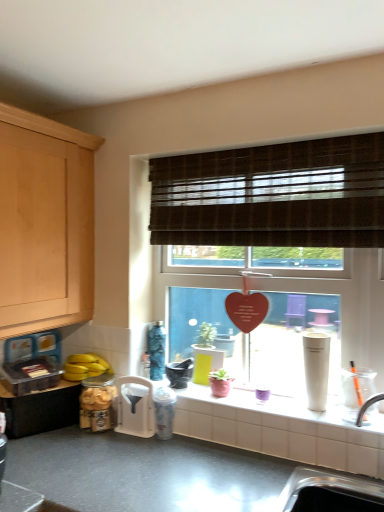
Describe the element at coordinates (329, 492) in the screenshot. Image resolution: width=384 pixels, height=512 pixels. I see `silver metallic sink at lower right` at that location.

Measure the distance between point (117, 418) and camera.

The depth of point (117, 418) is 5.91 feet.

What do you see at coordinates (246, 310) in the screenshot? I see `wooden heart at center` at bounding box center [246, 310].

This screenshot has height=512, width=384. I want to click on wooden heart at center, so click(246, 310).

The height and width of the screenshot is (512, 384). What do you see at coordinates (179, 373) in the screenshot?
I see `matte black mortar at center, which is the third appliance in left-to-right order` at bounding box center [179, 373].

The image size is (384, 512). Identify the location of metallic gray countertop at lower center. (144, 473).

This screenshot has width=384, height=512. I want to click on black matte cabinet at lower left, so click(40, 410).

Identify the location of silver metallic sink at lower right. (329, 492).

Based on the photo, from the image's perspective, is white plastic funnel at lower center, positioned as the second appliance in left-to-right order, beneath brown woven blind at upper center?

Yes.

Is white plastic funnel at lower center, positioned as the second appliance in left-to-right order, behind brown woven blind at upper center?

Yes, white plastic funnel at lower center, positioned as the second appliance in left-to-right order, is further from the viewer.

Which point is more forward, (133, 426) or (280, 169)?

Positioned in front is point (280, 169).

From a real-world perspective, is white plastic funnel at lower center, positioned as the second appliance in left-to-right order, physically located above or below brown woven blind at upper center?

From a real-world perspective, white plastic funnel at lower center, positioned as the second appliance in left-to-right order, is physically below brown woven blind at upper center.

Considering their positions, is matte white tile at center located in front of or behind brown woven blind at upper center?

matte white tile at center is positioned farther from the viewer than brown woven blind at upper center.

Is matte white tile at center inside the boundaries of brown woven blind at upper center, or outside?

matte white tile at center is spatially situated outside brown woven blind at upper center.

Is there a large distance between matte white tile at center and brown woven blind at upper center?

No, matte white tile at center is in close proximity to brown woven blind at upper center.

How distant is matte black mortar at center, which is the third appliance in left-to-right order, from metallic gray countertop at lower center?

matte black mortar at center, which is the third appliance in left-to-right order, is 18.60 inches from metallic gray countertop at lower center.

Is matte black mortar at center, which is the first appliance in right-to-left order, positioned with its back to metallic gray countertop at lower center?

matte black mortar at center, which is the first appliance in right-to-left order, is not turned away from metallic gray countertop at lower center.

From the image's perspective, relative to metallic gray countertop at lower center, is matte black mortar at center, which is the first appliance in right-to-left order, above or below?

matte black mortar at center, which is the first appliance in right-to-left order, is situated higher than metallic gray countertop at lower center in the image.

Can you see wooden heart at center touching matte glass jar at lower left, the 1th appliance from the left?

No, wooden heart at center is not beside matte glass jar at lower left, the 1th appliance from the left.

In the scene shown: Which of these two, wooden heart at center or matte glass jar at lower left, which is the 3th appliance from right to left, stands taller?

With more height is wooden heart at center.

What's the angular difference between wooden heart at center and matte glass jar at lower left, the 1th appliance from the left,'s facing directions?

The facing directions of wooden heart at center and matte glass jar at lower left, the 1th appliance from the left, are 2.98 degrees apart.

Which is closer to the camera, (240, 301) or (93, 391)?

Point (240, 301) is farther from the camera than point (93, 391).

Considering the relative positions of matte white tile at center and matte glass jar at lower left, the 1th appliance from the left, in the image provided, is matte white tile at center to the right of matte glass jar at lower left, the 1th appliance from the left, from the viewer's perspective?

Yes.

Consider the image. From their relative heights in the image, would you say matte white tile at center is taller or shorter than matte glass jar at lower left, which is the 3th appliance from right to left?

matte white tile at center is shorter than matte glass jar at lower left, which is the 3th appliance from right to left.

Which is in front, matte white tile at center or matte glass jar at lower left, which is the 3th appliance from right to left?

matte white tile at center is more forward.

This screenshot has width=384, height=512. Find the location of `window sill lying above the matte glass jar at lower left, which is the 3th appliance from right to left (from the image's perspective)`. window sill lying above the matte glass jar at lower left, which is the 3th appliance from right to left (from the image's perspective) is located at coordinates (269, 412).

At what (x,y) coordinates should I click in order to perform the action: click on heart behind the silver metallic sink at lower right. Please return your answer as a coordinate pair (x, y). This screenshot has width=384, height=512. Looking at the image, I should click on (246, 310).

Which of these two, wooden heart at center or silver metallic sink at lower right, stands shorter?

silver metallic sink at lower right.

From a real-world perspective, is wooden heart at center physically located above or below silver metallic sink at lower right?

Clearly, from a real-world perspective, wooden heart at center is above silver metallic sink at lower right.

Consider the image. Is metallic gray countertop at lower center looking in the opposite direction of matte white tile at center?

No, metallic gray countertop at lower center is not facing away from matte white tile at center.

From the image's perspective, is metallic gray countertop at lower center located beneath matte white tile at center?

Yes, from the image's perspective, metallic gray countertop at lower center is beneath matte white tile at center.

Can you confirm if metallic gray countertop at lower center is bigger than matte white tile at center?

Correct, metallic gray countertop at lower center is larger in size than matte white tile at center.

Does metallic gray countertop at lower center come in front of matte white tile at center?

Yes, metallic gray countertop at lower center is closer to the camera.

In order to click on window blind on the right of white plastic funnel at lower center, positioned as the second appliance in left-to-right order in this screenshot , I will do `click(273, 195)`.

Where is `window sill below the brown woven blind at upper center (from a real-world perspective)`? This screenshot has height=512, width=384. window sill below the brown woven blind at upper center (from a real-world perspective) is located at coordinates (269, 412).

Estimate the real-world distances between objects in this image. Which object is further from metallic gray countertop at lower center, black matte cabinet at lower left or brown woven blind at upper center?

Based on the image, brown woven blind at upper center appears to be further to metallic gray countertop at lower center.

Looking at the image, which one is located further to matte glass jar at lower left, the 1th appliance from the left, silver metallic sink at lower right or brown woven blind at upper center?

brown woven blind at upper center is further to matte glass jar at lower left, the 1th appliance from the left.

Looking at the image, which one is located further to brown woven blind at upper center, yellow matte bananas at lower left or silver metallic sink at lower right?

silver metallic sink at lower right.

When comparing their distances from matte white tile at center, does brown woven blind at upper center or matte glass jar at lower left, the 1th appliance from the left, seem closer?

matte glass jar at lower left, the 1th appliance from the left.

From the image, which object appears to be farther from brown woven blind at upper center, metallic gray countertop at lower center or yellow matte bananas at lower left?

metallic gray countertop at lower center lies further to brown woven blind at upper center than the other object.

Based on their spatial positions, is metallic gray countertop at lower center or yellow matte bananas at lower left further from matte glass jar at lower left, which is the 3th appliance from right to left?

metallic gray countertop at lower center is positioned further to the anchor matte glass jar at lower left, which is the 3th appliance from right to left.

Looking at the image, which one is located closer to black matte cabinet at lower left, yellow matte bananas at lower left or matte glass jar at lower left, which is the 3th appliance from right to left?

The object closer to black matte cabinet at lower left is matte glass jar at lower left, which is the 3th appliance from right to left.

Based on their spatial positions, is brown woven blind at upper center or matte black mortar at center, which is the third appliance in left-to-right order, further from yellow matte bananas at lower left?

Among the two, brown woven blind at upper center is located further to yellow matte bananas at lower left.

The width and height of the screenshot is (384, 512). Identify the location of sink between metallic gray countertop at lower center and matte black mortar at center, which is the first appliance in right-to-left order, from front to back. (329, 492).

I want to click on window sill between metallic gray countertop at lower center and silver metallic sink at lower right from left to right, so click(269, 412).

The image size is (384, 512). In order to click on heart between black matte cabinet at lower left and brown woven blind at upper center in this screenshot , I will do `click(246, 310)`.

This screenshot has height=512, width=384. Identify the location of food between black matte cabinet at lower left and brown woven blind at upper center. (85, 366).